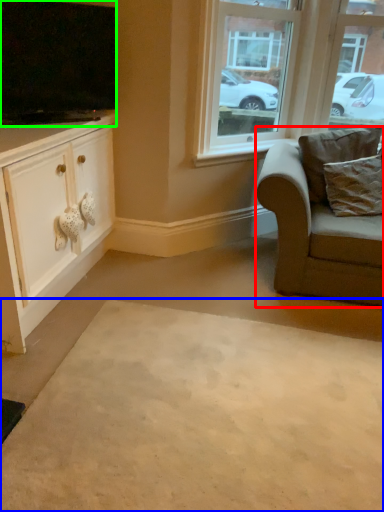
Question: Estimate the real-world distances between objects in this image. Which object is farther from chair (highlighted by a red box), plain (highlighted by a blue box) or television (highlighted by a green box)?

Choices:
 (A) plain
 (B) television

Answer: (B)